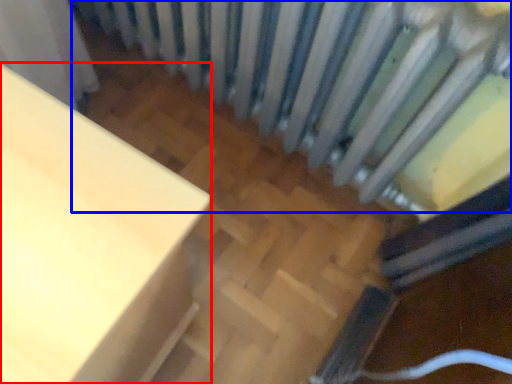
Question: Which object is closer to the camera taking this photo, furniture (highlighted by a red box) or radiator (highlighted by a blue box)?

Choices:
 (A) furniture
 (B) radiator

Answer: (A)